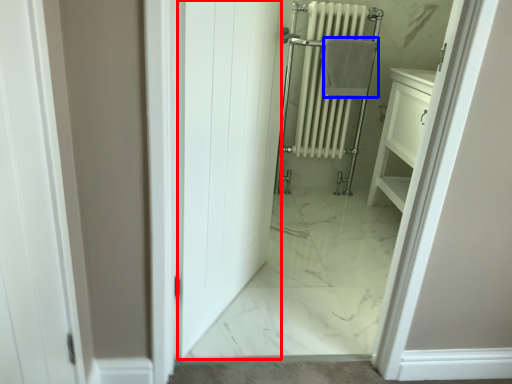
Question: Which object appears farthest to the camera in this image, door (highlighted by a red box) or bath towel (highlighted by a blue box)?

Choices:
 (A) door
 (B) bath towel

Answer: (B)